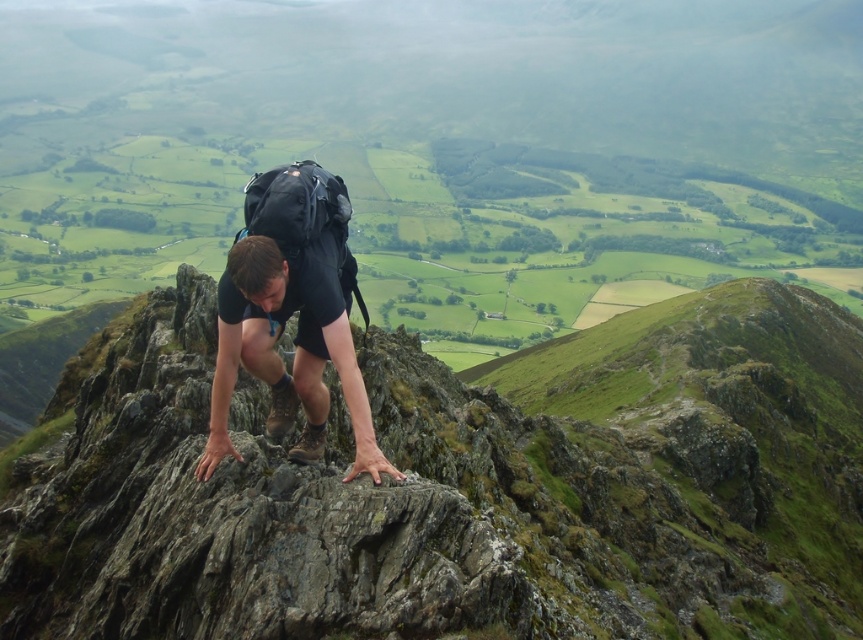
In order to click on black matte shorts at center in this screenshot , I will do tap(295, 346).